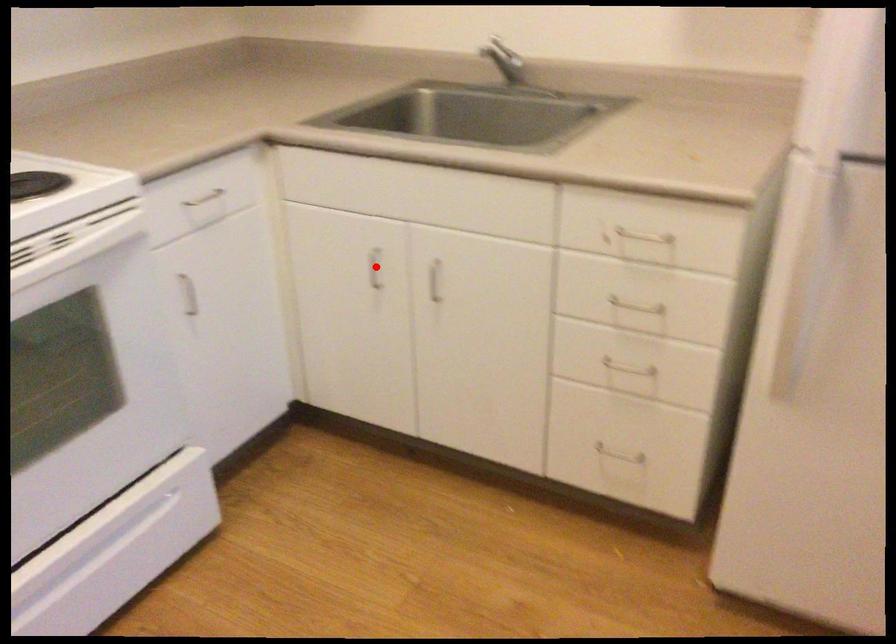
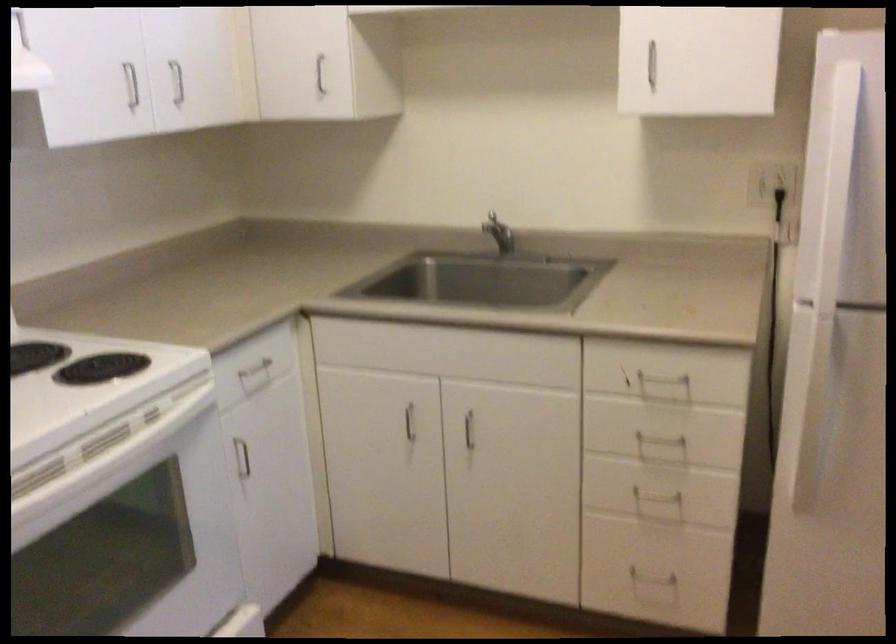
Where in the second image is the point corresponding to the highlighted location from the first image?

(409, 422)